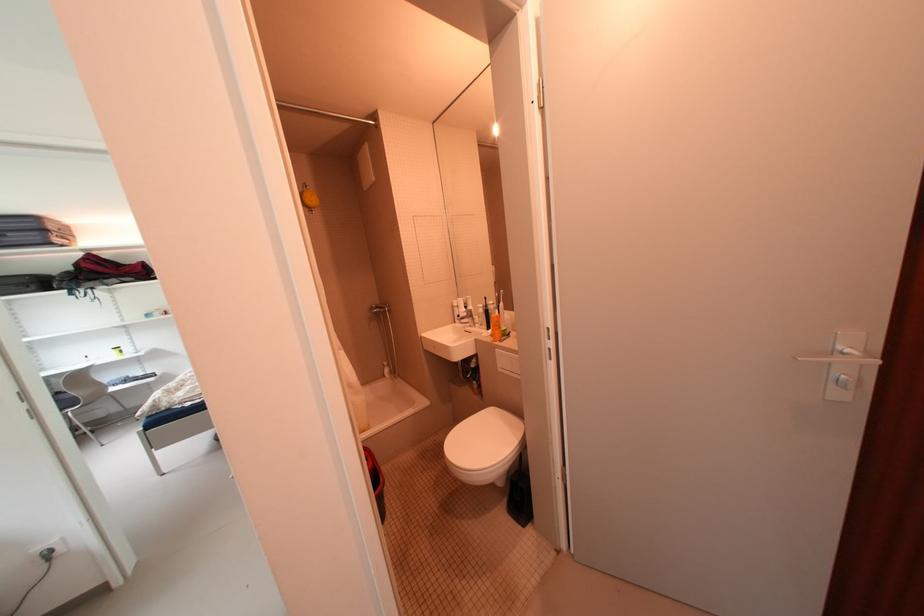
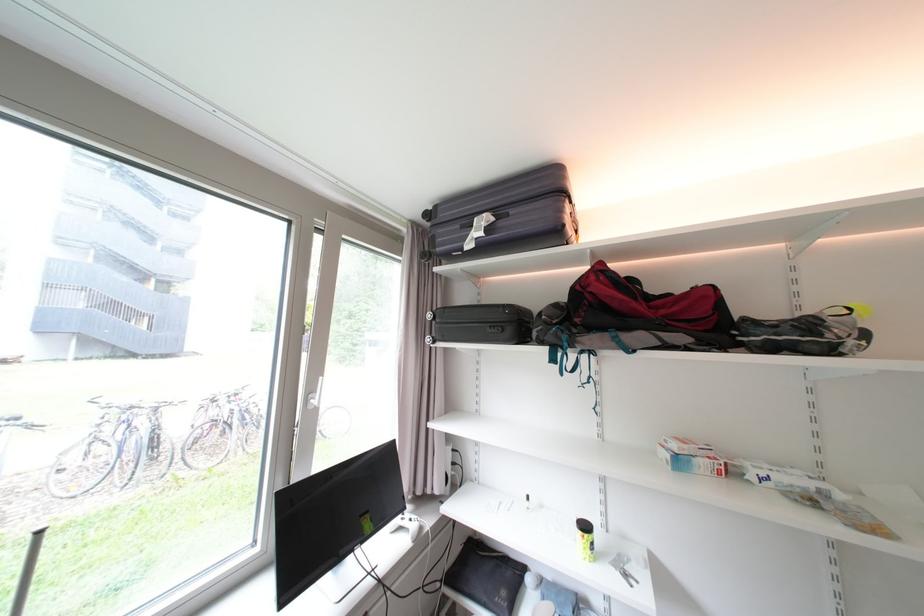
Locate, in the second image, the point that corresponds to point (165, 315) in the first image.

(711, 464)